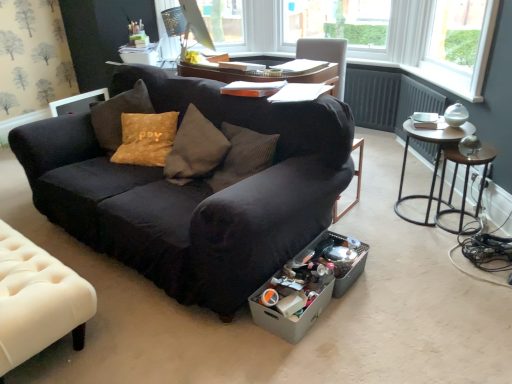
Question: From the image's perspective, is metallic round table at right located above or below white tufted leather at lower left?

Choices:
 (A) below
 (B) above

Answer: (B)

Question: From their relative heights in the image, would you say metallic round table at right is taller or shorter than white tufted leather at lower left?

Choices:
 (A) tall
 (B) short

Answer: (A)

Question: Which of these objects is positioned farthest from the metallic round table at right?

Choices:
 (A) white tufted leather at lower left
 (B) matte black monitor at upper center
 (C) metallic brown side table at right
 (D) black fabric couch at center
 (E) gray cardboard box at lower center

Answer: (B)

Question: Which object is the closest to the gray cardboard box at lower center?

Choices:
 (A) black fabric couch at center
 (B) white tufted leather at lower left
 (C) matte black monitor at upper center
 (D) metallic brown side table at right
 (E) metallic round table at right

Answer: (A)